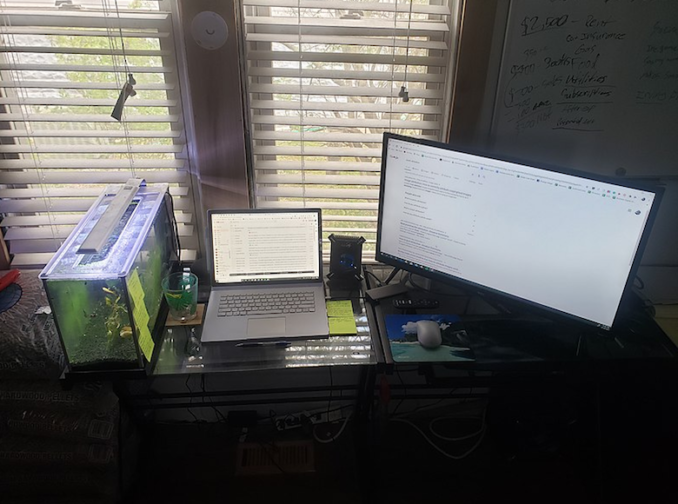
Find the location of `computer screen`. computer screen is located at coordinates (504, 234), (262, 250).